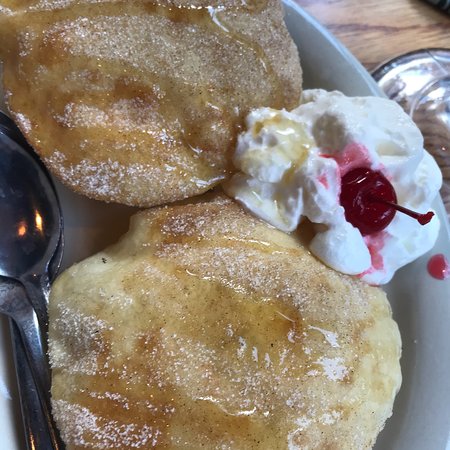
You are a GUI agent. You are given a task and a screenshot of the screen. Output one action in this format:
    pyautogui.click(x=<x>, y=<y>)
    Task: Click on the bowl
    
    Given the screenshot: What is the action you would take?
    pyautogui.click(x=424, y=351)